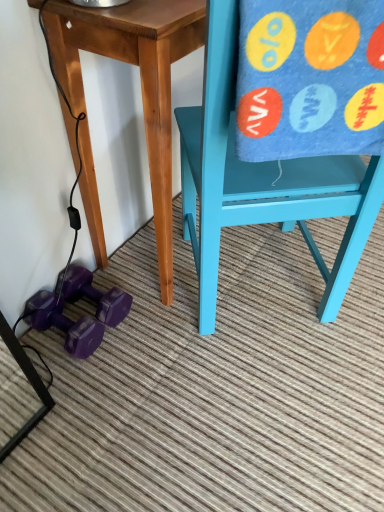
At what (x,y) coordinates should I click in order to perform the action: click on vacant area to the right of purple rubber dumbbell at lower left, which is the 2th dumbbell in bottom-to-top order. Please return your answer as a coordinate pair (x, y). This screenshot has width=384, height=512. Looking at the image, I should click on (158, 310).